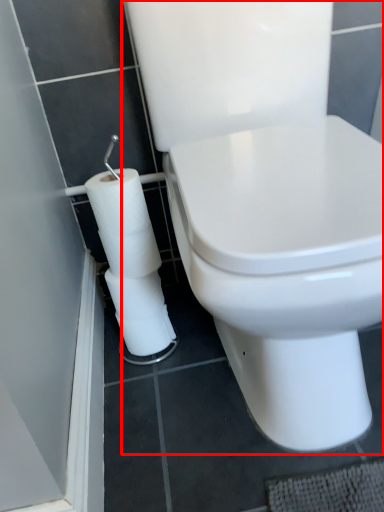
Question: Where is toilet (annotated by the red box) located in relation to toilet paper in the image?

Choices:
 (A) left
 (B) right

Answer: (B)